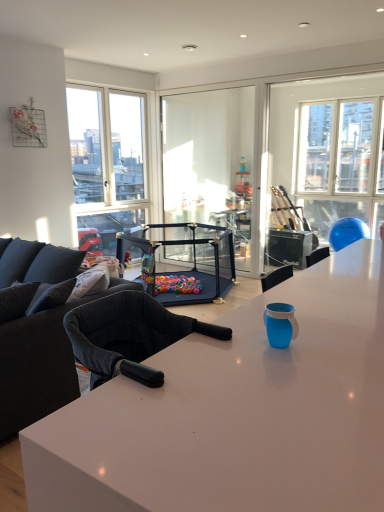
The height and width of the screenshot is (512, 384). Find the location of `free spot above transparent glass window at upper right (from a real-world perspective)`. free spot above transparent glass window at upper right (from a real-world perspective) is located at coordinates (332, 71).